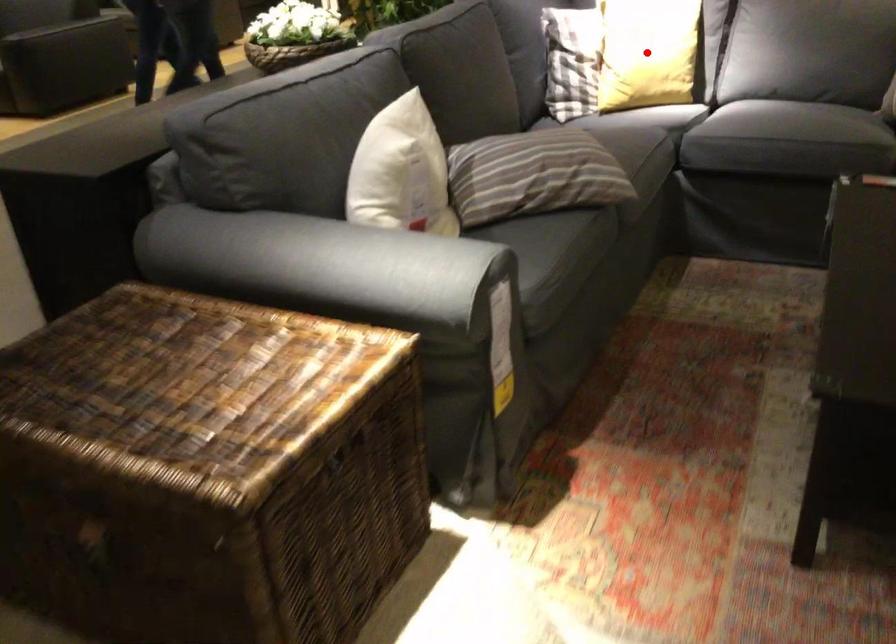
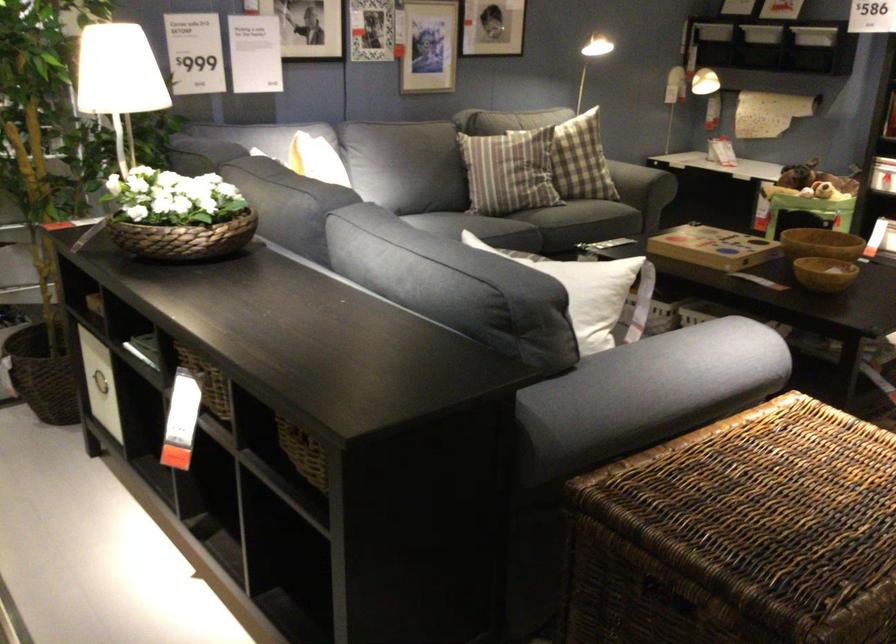
Question: I am providing you with two images of the same scene from different viewpoints. A red point is marked on the first image. Is the red point's position out of view in image 2?

Choices:
 (A) Yes
 (B) No

Answer: (A)